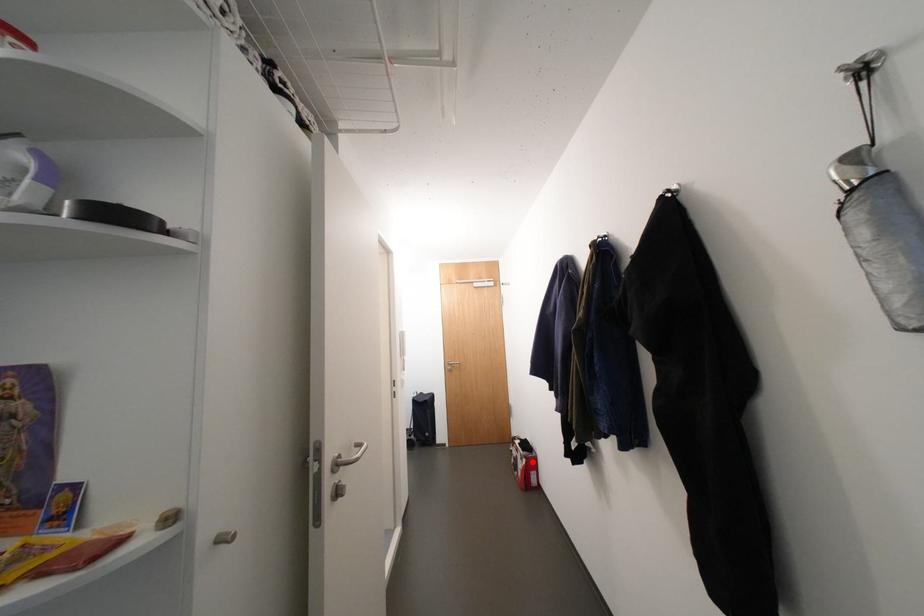
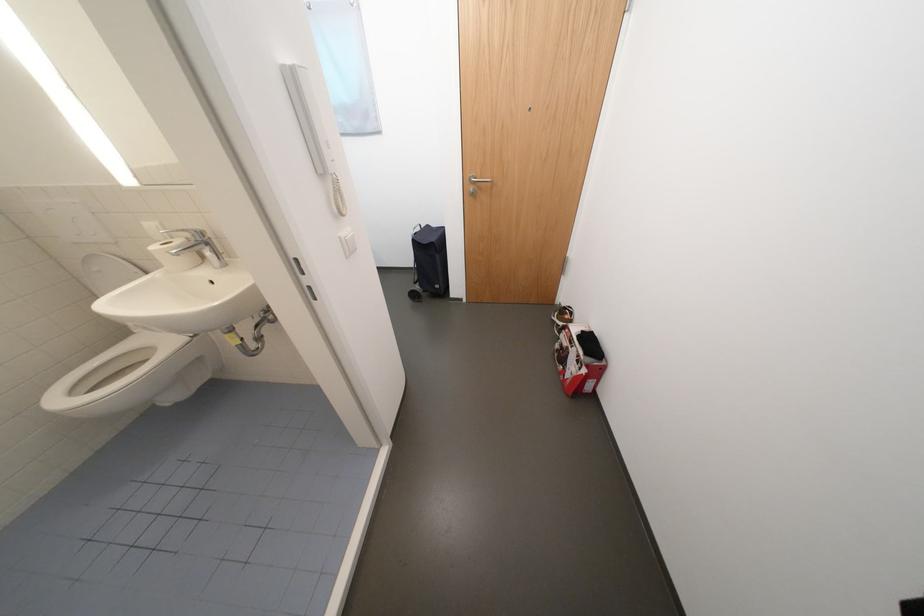
Where in the second image is the point corresponding to the highlighted location from the first image?

(592, 371)